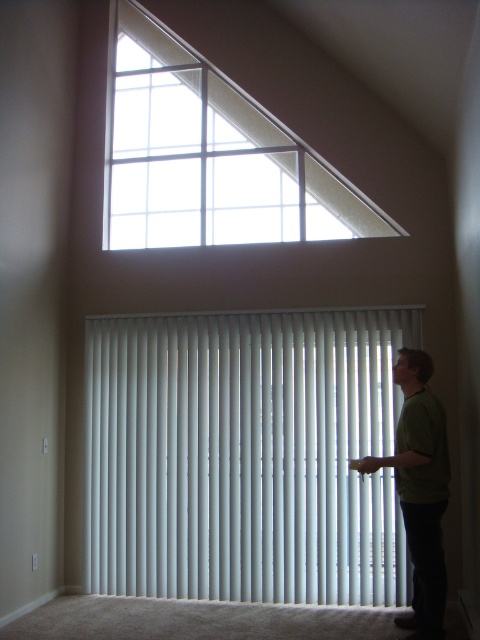
Question: Is white vertical blinds at center further to the viewer compared to green matte shirt at right?

Choices:
 (A) no
 (B) yes

Answer: (B)

Question: Does white vertical blinds at center appear under clear glass window at upper center?

Choices:
 (A) no
 (B) yes

Answer: (B)

Question: Does clear glass window at upper center have a smaller size compared to green matte shirt at right?

Choices:
 (A) no
 (B) yes

Answer: (A)

Question: Which of these objects is positioned farthest from the white vertical blinds at center?

Choices:
 (A) green matte shirt at right
 (B) clear glass window at upper center

Answer: (B)

Question: Which object is the farthest from the white vertical blinds at center?

Choices:
 (A) green matte shirt at right
 (B) clear glass window at upper center

Answer: (B)

Question: Among these points, which one is farthest from the camera?

Choices:
 (A) (181, 426)
 (B) (440, 436)
 (C) (145, 243)

Answer: (C)